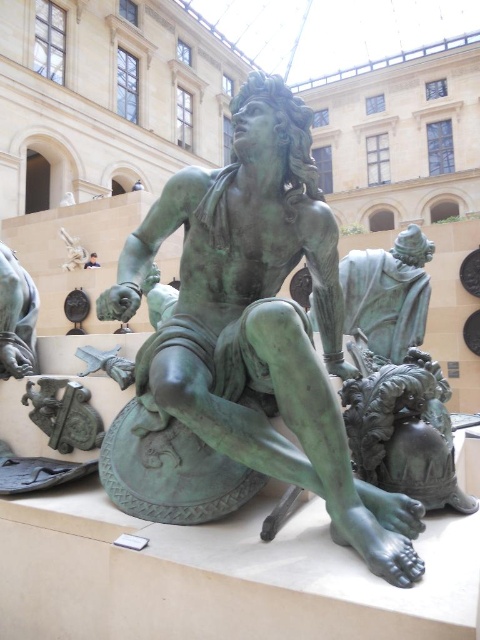
Looking at this image, is green patina bronze statue at center above green patina statue at center?

Actually, green patina bronze statue at center is below green patina statue at center.

Image resolution: width=480 pixels, height=640 pixels. Describe the element at coordinates (260, 323) in the screenshot. I see `green patina bronze statue at center` at that location.

Find the location of a particular element. Image resolution: width=480 pixels, height=640 pixels. green patina bronze statue at center is located at coordinates (260, 323).